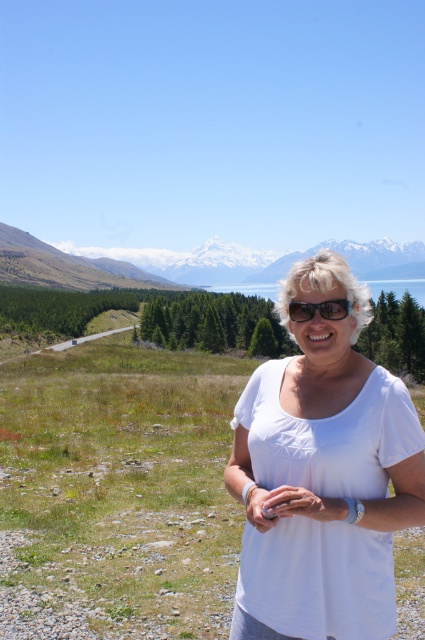
Question: Is white cotton shirt at center behind snowy granite mountain at upper left?

Choices:
 (A) yes
 (B) no

Answer: (B)

Question: Does white cotton shirt at center come in front of snowy granite mountain at upper left?

Choices:
 (A) yes
 (B) no

Answer: (A)

Question: Which point is farther from the camera taking this photo?

Choices:
 (A) (221, 289)
 (B) (317, 307)
 (C) (397, 476)

Answer: (A)

Question: Can you confirm if white cotton shirt at center is wider than snowy granite mountain at upper left?

Choices:
 (A) yes
 (B) no

Answer: (B)

Question: Which is nearer to the snowy granite mountain at upper left?

Choices:
 (A) white cotton shirt at center
 (B) clear blue water at center

Answer: (B)

Question: Which point is closer to the camera taking this photo?

Choices:
 (A) (329, 316)
 (B) (319, 387)
 (C) (150, 285)

Answer: (A)